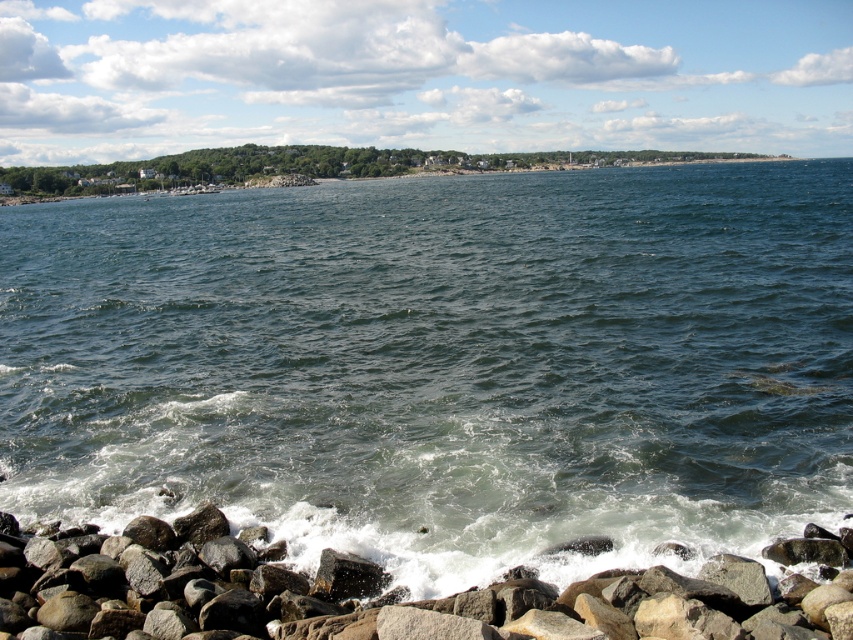
You are standing on the shore looking at the dark blue water at center and the gray rock at lower left. Which object is closer to you?

The gray rock at lower left is closer to you because it is positioned in front of the dark blue water at center.

Consider the image. You are standing on the gray rock at lower left and want to reach the dark blue water at center. Which direction should you move to get there?

You should move to the right because the dark blue water at center is located to the left of the gray rock at lower left, so moving right from the gray rock will lead you towards the water.